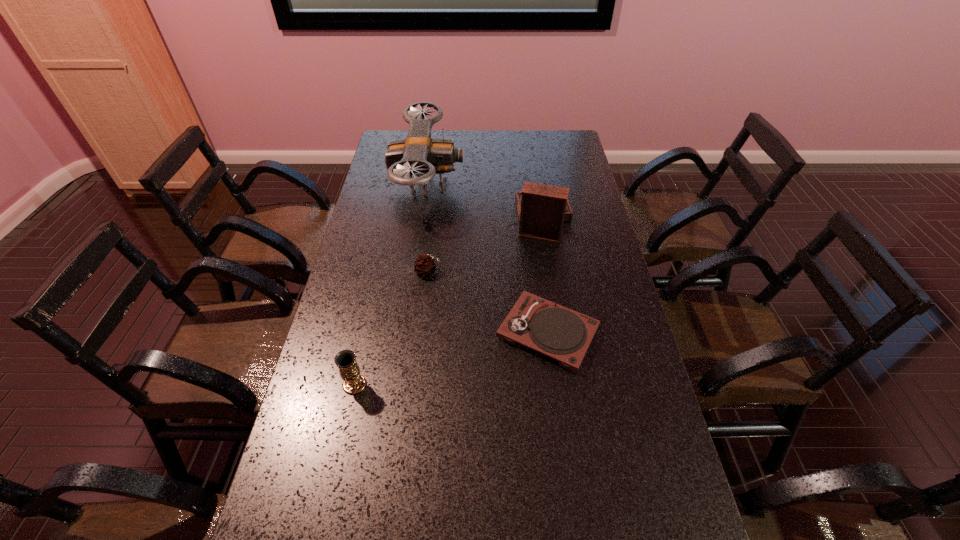
In order to click on vacant space situated on the back of the third tallest object in this screenshot , I will do `click(365, 340)`.

Find the location of a particular element. vacant space located with a leaf charm attached to the third nearest object is located at coordinates (518, 272).

The height and width of the screenshot is (540, 960). Identify the location of vacant space located 0.350m on the front of the shortest object. (573, 520).

Find the location of a particular element. This screenshot has width=960, height=540. object that is at the far edge is located at coordinates (418, 155).

Find the location of `drone that is at the left edge`. drone that is at the left edge is located at coordinates (418, 155).

The height and width of the screenshot is (540, 960). I want to click on chalice present at the left edge, so click(345, 360).

The height and width of the screenshot is (540, 960). In order to click on object positioned at the far left corner in this screenshot , I will do `click(418, 155)`.

This screenshot has height=540, width=960. In order to click on free region at the far edge of the desktop in this screenshot , I will do `click(469, 146)`.

Where is `vacant space at the left edge`? The width and height of the screenshot is (960, 540). vacant space at the left edge is located at coordinates (408, 210).

Identify the location of free space at the right edge of the desktop. (599, 221).